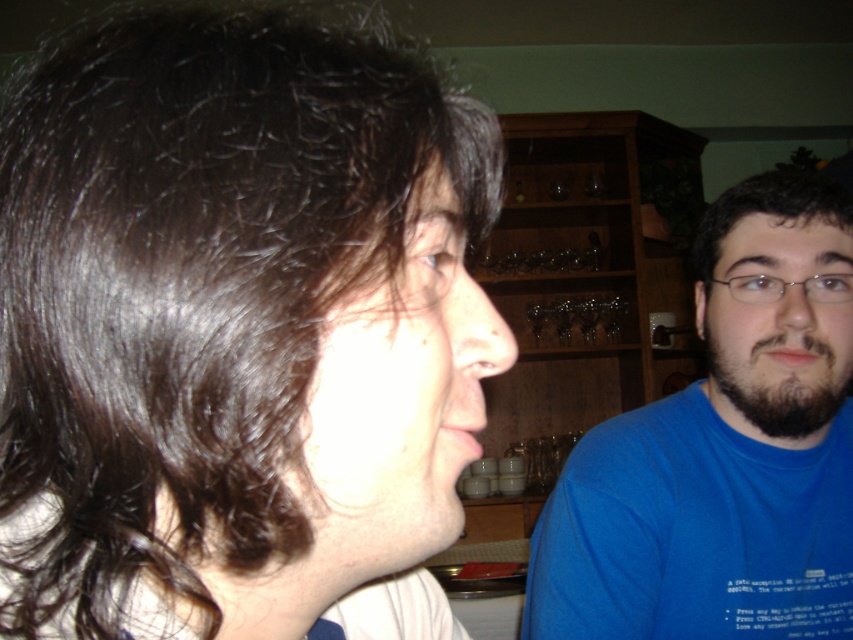
Identify the location of dark brown hair at upper left. The image size is (853, 640). (236, 330).

Is point (424, 308) positioned behind point (427, 244)?

No, (424, 308) is in front of (427, 244).

This screenshot has width=853, height=640. In order to click on dark brown hair at upper left in this screenshot , I will do `click(236, 330)`.

Which of these two, dark brown hair at upper left or blue t-shirt at right, stands shorter?

dark brown hair at upper left is shorter.

Find the location of a particular element. The width and height of the screenshot is (853, 640). dark brown hair at upper left is located at coordinates (236, 330).

Is dark brown hair at upper left taller than dark brown beard at right?

Indeed, dark brown hair at upper left has a greater height compared to dark brown beard at right.

Is point (267, 445) closer to viewer compared to point (770, 422)?

Yes.

The width and height of the screenshot is (853, 640). Describe the element at coordinates (236, 330) in the screenshot. I see `dark brown hair at upper left` at that location.

Locate an element on the screen. This screenshot has height=640, width=853. dark brown hair at upper left is located at coordinates (236, 330).